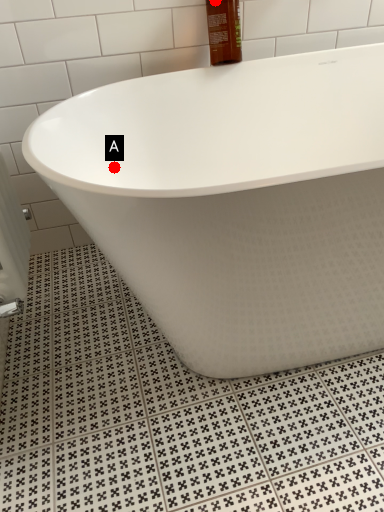
Question: Two points are circled on the image, labeled by A and B beside each circle. Which point is farther from the camera taking this photo?

Choices:
 (A) A is further
 (B) B is further

Answer: (A)